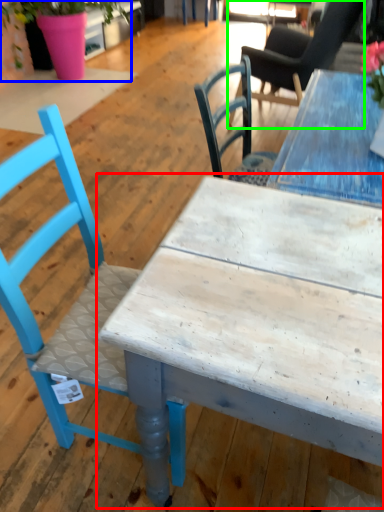
Question: Which is nearer to the table (highlighted by a red box)? houseplant (highlighted by a blue box) or chair (highlighted by a green box).

Choices:
 (A) houseplant
 (B) chair

Answer: (B)